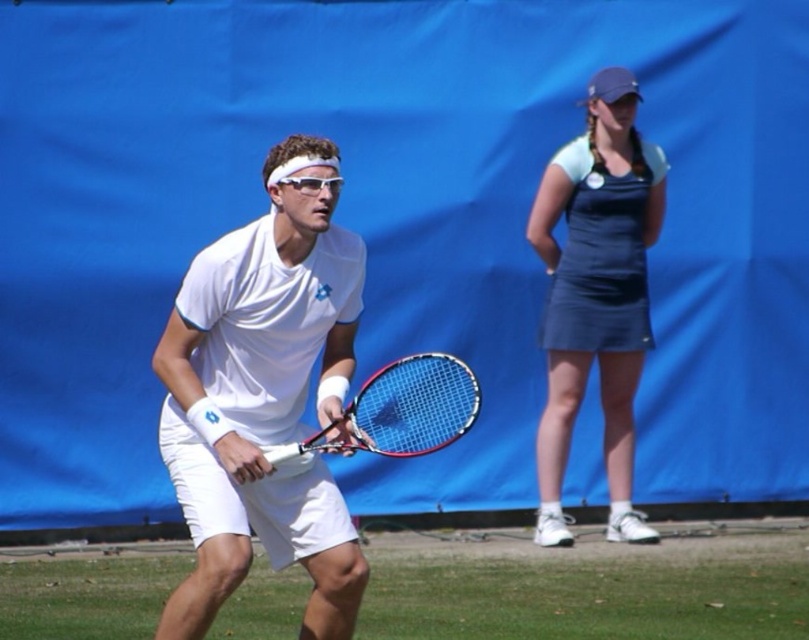
Who is taller, dark blue fabric dress at upper right or matte blue racket at center?

dark blue fabric dress at upper right is taller.

Is dark blue fabric dress at upper right below matte blue racket at center?

Incorrect, dark blue fabric dress at upper right is not positioned below matte blue racket at center.

Does point (617, 276) come closer to viewer compared to point (458, 371)?

No.

You are a GUI agent. You are given a task and a screenshot of the screen. Output one action in this format:
    pyautogui.click(x=<x>, y=<y>)
    Task: Click on the dark blue fabric dress at upper right
    
    Given the screenshot: What is the action you would take?
    pyautogui.click(x=596, y=292)

Between white matte tennis racket at center and matte blue racket at center, which one is positioned lower?

matte blue racket at center is lower down.

Does white matte tennis racket at center appear under matte blue racket at center?

Incorrect, white matte tennis racket at center is not positioned below matte blue racket at center.

Identify the location of white matte tennis racket at center. Image resolution: width=809 pixels, height=640 pixels. (265, 396).

The image size is (809, 640). Find the location of `white matte tennis racket at center`. white matte tennis racket at center is located at coordinates (265, 396).

Between white matte tennis racket at center and dark blue fabric dress at upper right, which one appears on the left side from the viewer's perspective?

white matte tennis racket at center

Does white matte tennis racket at center lie behind dark blue fabric dress at upper right?

No, it is not.

Who is more distant from viewer, (265, 404) or (587, 364)?

The point (587, 364) is behind.

The width and height of the screenshot is (809, 640). I want to click on white matte tennis racket at center, so click(265, 396).